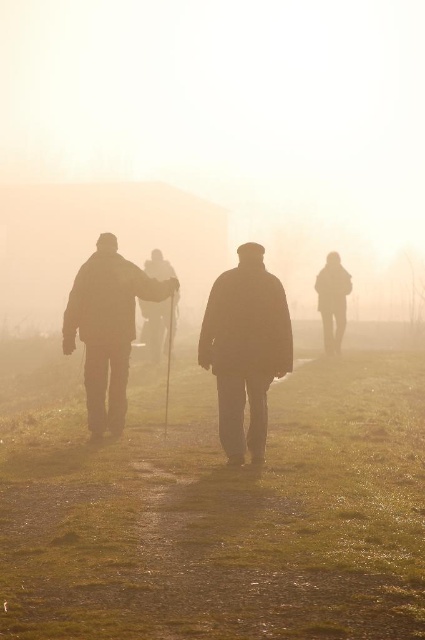
Question: Which point is closer to the camera?

Choices:
 (A) green grassy at center
 (B) silhouette coat at center
 (C) silhouette wooden cane at center

Answer: (A)

Question: Does silhouette coat at center have a greater width compared to silhouette wooden cane at center?

Choices:
 (A) yes
 (B) no

Answer: (B)

Question: Based on their relative distances, which object is nearer to the green grassy at center?

Choices:
 (A) silhouette coat at center
 (B) silhouette wooden cane at center

Answer: (A)

Question: Which of these objects is positioned farthest from the silhouette coat at center?

Choices:
 (A) green grassy at center
 (B) silhouette wooden cane at center

Answer: (B)

Question: Does green grassy at center have a lesser width compared to silhouette coat at center?

Choices:
 (A) no
 (B) yes

Answer: (A)

Question: Considering the relative positions of silhouette coat at center and silhouette wooden cane at center in the image provided, where is silhouette coat at center located with respect to silhouette wooden cane at center?

Choices:
 (A) above
 (B) below

Answer: (B)